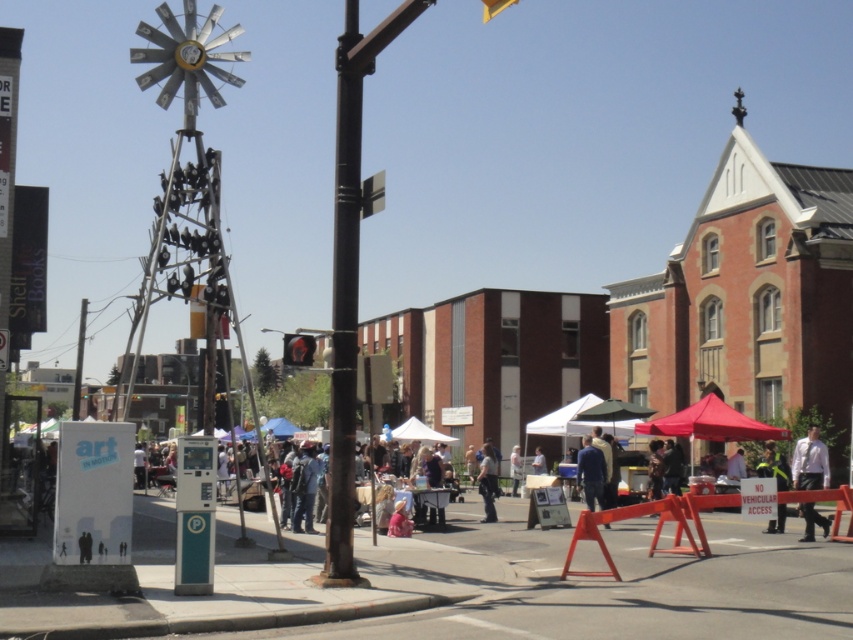
You are a customer at the market and see both the light blue jeans at center and the blue fabric canopy at center. Which item is located above the other?

The light blue jeans at center is positioned over the blue fabric canopy at center, so the light blue jeans at center is above the blue fabric canopy at center.

You are a visitor at the market and want to take a photo of the white plastic sign at upper left without the blue fabric canopy at center blocking the view. Is this possible from your current position?

The blue fabric canopy at center is further to the viewer than the white plastic sign at upper left, so it is blocking the view. Move closer to the white plastic sign at upper left to take a photo without obstruction.

You are a delivery person trying to navigate the market to deliver a package. You need to move from the blue fabric canopy at center to the white plastic sign at upper left. Given that your delivery cart can only move in straight lines and has a maximum range of 70 meters, will you be able to reach the sign from the canopy?

The distance between the blue fabric canopy at center and the white plastic sign at upper left is 72.44 meters, which exceeds the delivery cart maximum range of 70 meters. Therefore, you cannot reach the sign from the canopy.